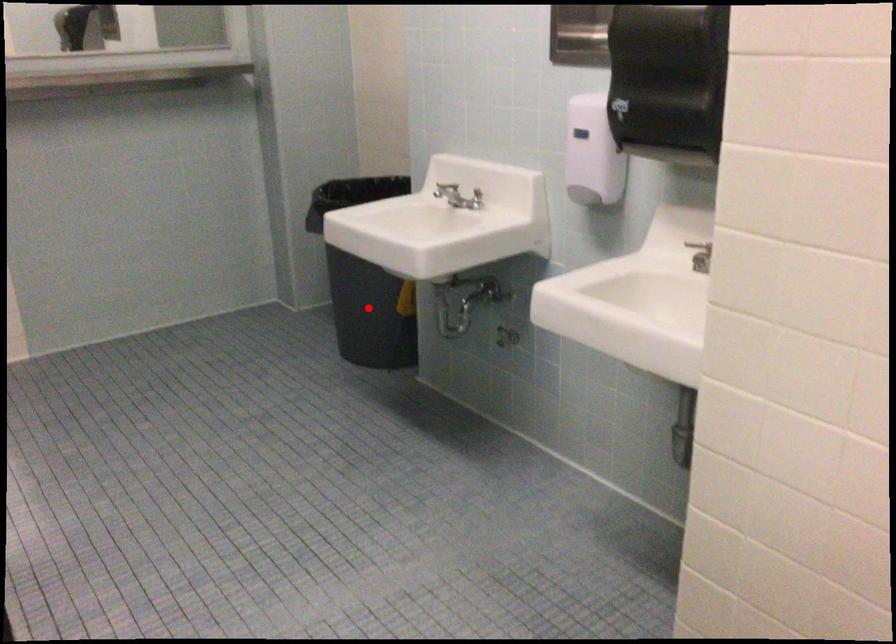
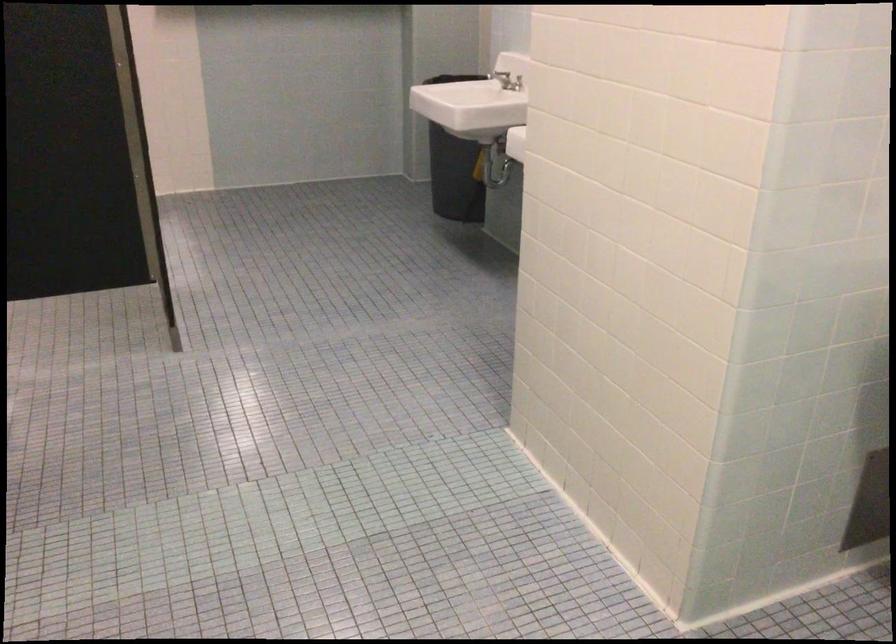
Question: I am providing you with two images of the same scene from different viewpoints. In image1, a red point is highlighted. Considering the same 3D point in image2, which of the following is correct?

Choices:
 (A) It is closer
 (B) It is farther

Answer: (B)